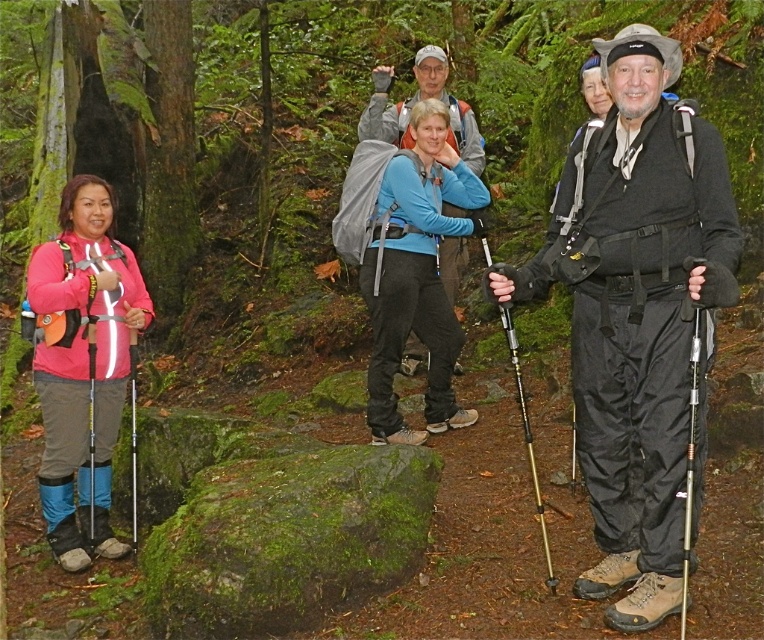
You are a hiker trying to decide whether to take a photo of the pink fabric jacket at left and the silver metallic ski pole at right. Since you want to ensure both items are clearly visible in the frame, which object should you focus on to capture both in the same shot?

You should focus on the pink fabric jacket at left because it is larger than the silver metallic ski pole at right, making it easier to frame both items clearly.

You are a hiker trying to locate your misplaced ski pole. You remember seeing a pink fabric jacket at left and a yellow metallic ski pole at left. Based on the scene description, which object is positioned higher up in the image?

The pink fabric jacket at left is located above the yellow metallic ski pole at left, so the pink fabric jacket at left is positioned higher up in the image.

You are a hiker trying to locate your misplaced ski pole. You see the pink fabric jacket at left and the yellow metallic ski pole at left in the scene. Which object is nearer to you?

The pink fabric jacket at left is closer to the viewer than the yellow metallic ski pole at left, so the ski pole is farther away from you.